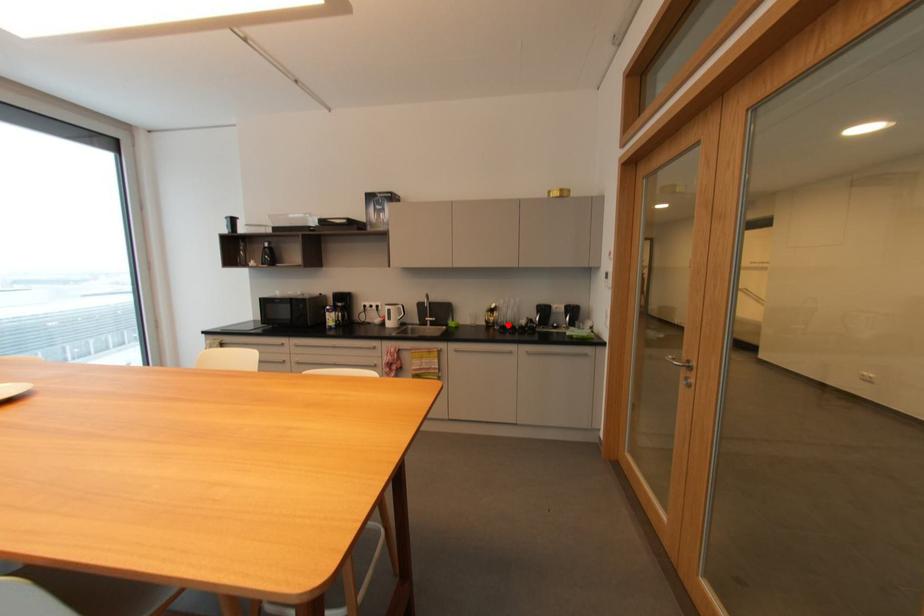
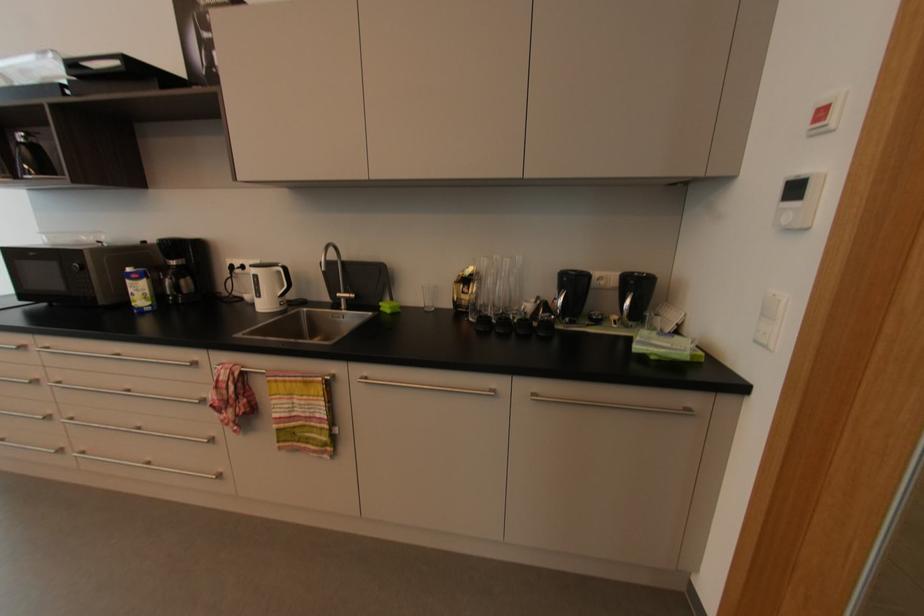
Find the pixel in the second image that matches the highlighted location in the first image.

(493, 313)